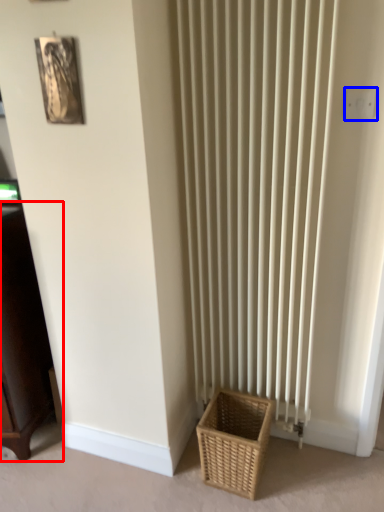
Question: Which object is closer to the camera taking this photo, furniture (highlighted by a red box) or electric outlet (highlighted by a blue box)?

Choices:
 (A) furniture
 (B) electric outlet

Answer: (B)